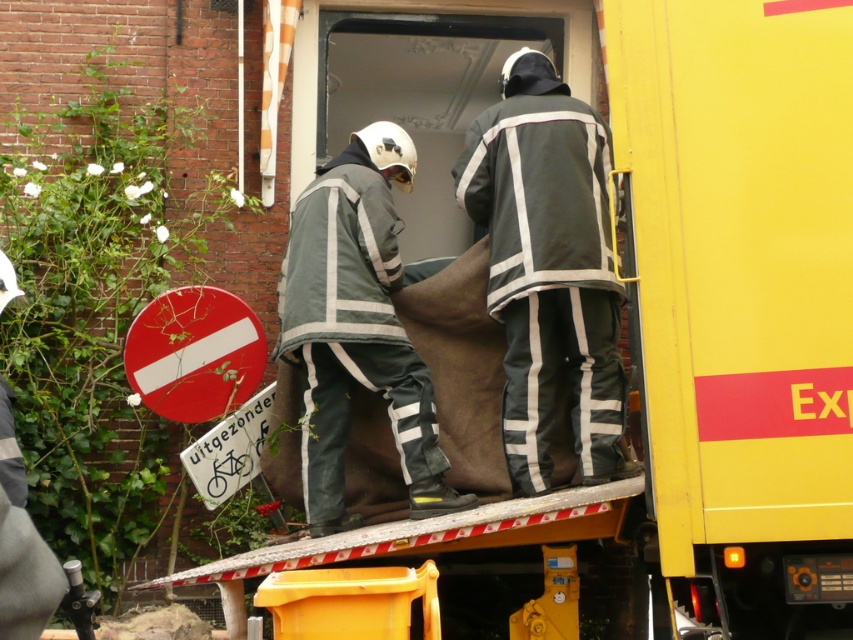
Between dark green fabric suit at center and gray fabric fireman at center, which one is positioned lower?

gray fabric fireman at center

Is dark green fabric suit at center smaller than gray fabric fireman at center?

Yes.

Where is `dark green fabric suit at center`? dark green fabric suit at center is located at coordinates (547, 266).

The image size is (853, 640). I want to click on dark green fabric suit at center, so click(547, 266).